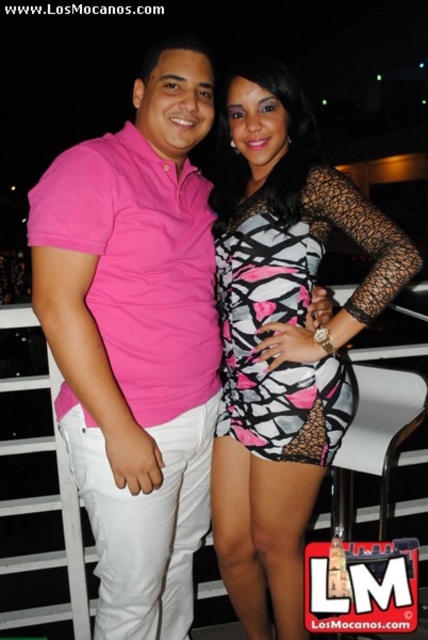
You are a photographer standing 1.5 meters away from the camera. You want to take a photo of the pink and white geometric dress at center. Can you reach the dress within your current position?

The pink and white geometric dress at center is 1.41 meters from the camera. Since you are standing 1.5 meters away from the camera, you are slightly farther than the dress. To take a photo, you can move closer to the dress so that it remains in frame without obstruction.